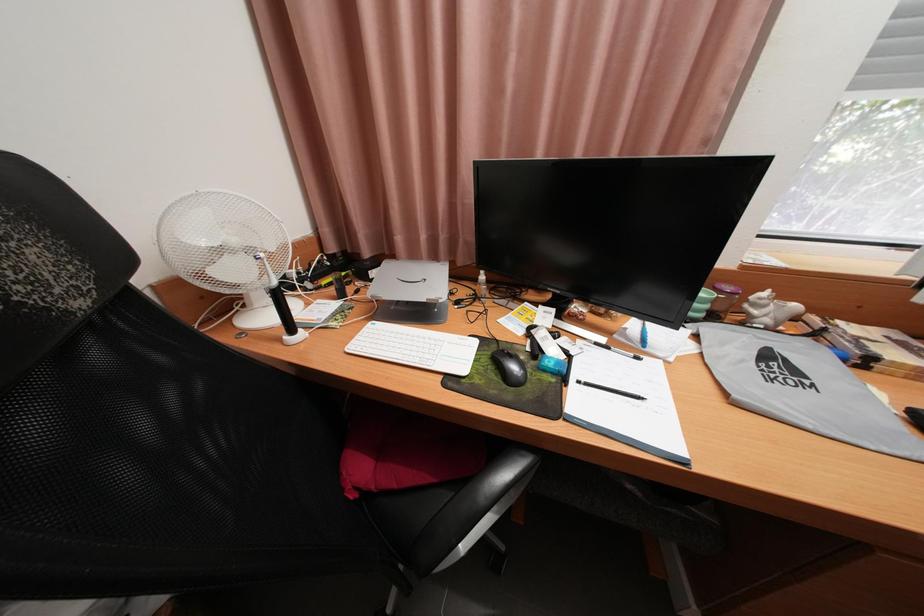
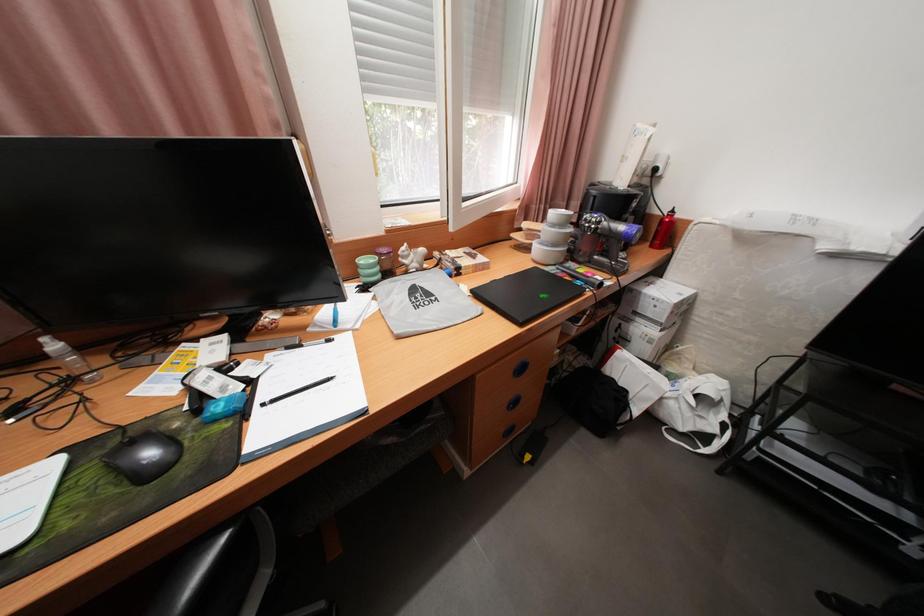
Question: The camera is either moving clockwise (left) or counter-clockwise (right) around the object. The first image is from the beginning of the video and the second image is from the end. Is the camera moving left or right when shooting the video?

Choices:
 (A) Left
 (B) Right

Answer: (A)